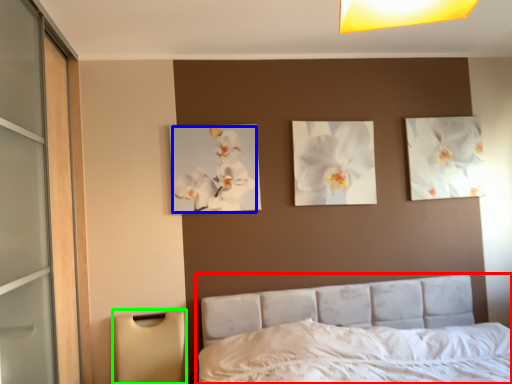
Question: Which object is positioned farthest from bed (highlighted by a red box)? Select from flower (highlighted by a blue box) and lamp (highlighted by a green box).

Choices:
 (A) flower
 (B) lamp

Answer: (A)